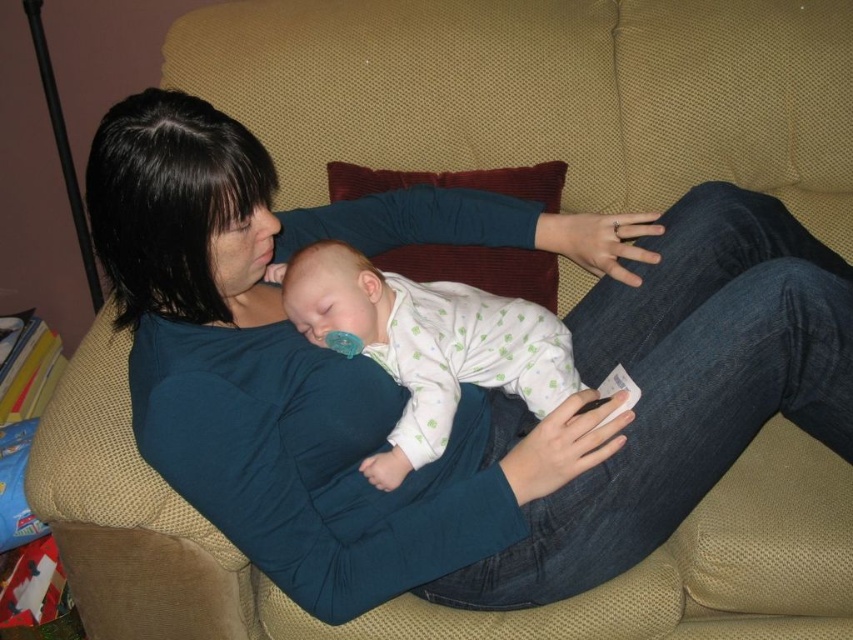
You are an interior designer observing the couch in the scene. You need to place a decorative pillow on the couch such that it is to the left of both the matte blue shirt at center and the white dotted fabric at center. Is this possible?

The matte blue shirt at center is to the right of the white dotted fabric at center. Therefore, placing a decorative pillow to the left of both would require it to be positioned to the left of the white dotted fabric at center, which is the leftmost object between the two. This placement would satisfy the requirement as the pillow would naturally be left of both.